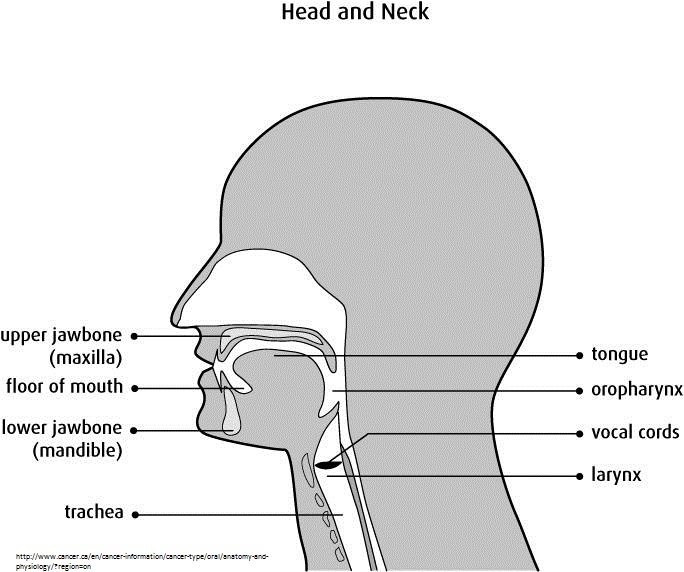
The width and height of the screenshot is (684, 572). Find the location of `poster`. poster is located at coordinates (412, 331).